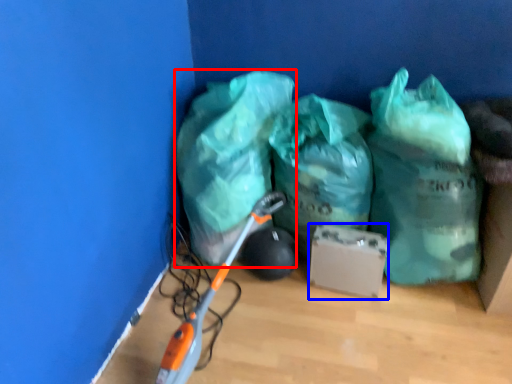
Question: Which of the following is the closest to the observer, plastic bag (highlighted by a red box) or cardboard box (highlighted by a blue box)?

Choices:
 (A) plastic bag
 (B) cardboard box

Answer: (A)